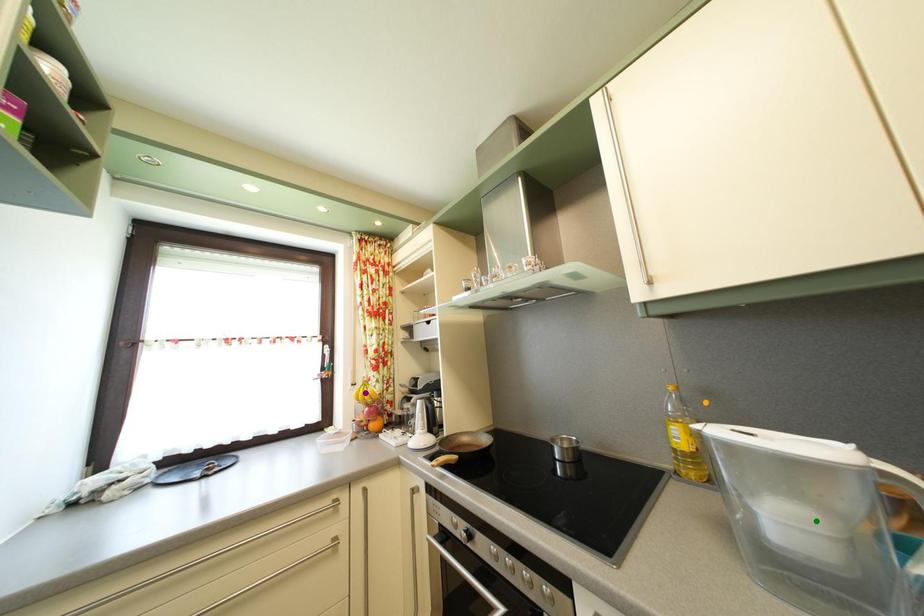
Order these from nearest to farthest:
A) orange point
B) green point
C) purple point

green point → orange point → purple point